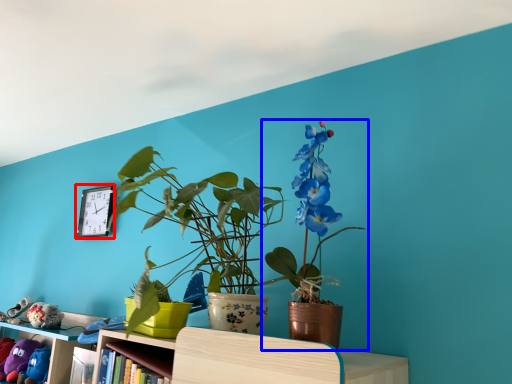
Question: Among these objects, which one is nearest to the camera, clock (highlighted by a red box) or houseplant (highlighted by a blue box)?

Choices:
 (A) clock
 (B) houseplant

Answer: (B)